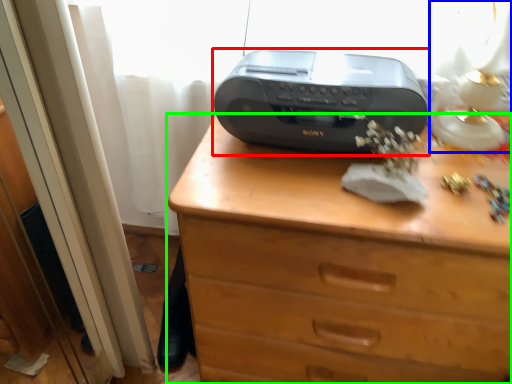
Question: Based on their relative distances, which object is farther from printer (highlighted by a red box)? Choose from table lamp (highlighted by a blue box) and chest of drawers (highlighted by a green box).

Choices:
 (A) table lamp
 (B) chest of drawers

Answer: (A)